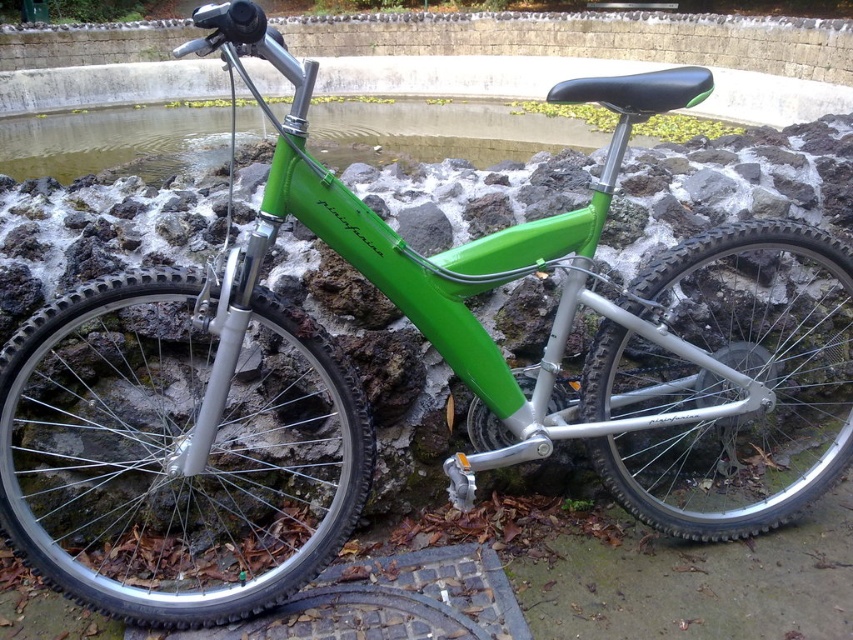
Can you confirm if green rubber tire at lower left is wider than green rubber tire at center?

No, green rubber tire at lower left is not wider than green rubber tire at center.

Looking at this image, can you confirm if green rubber tire at lower left is shorter than green rubber tire at center?

Yes, green rubber tire at lower left is shorter than green rubber tire at center.

What are the coordinates of `green rubber tire at lower left` in the screenshot? It's located at click(x=173, y=452).

Is point (689, 337) positioned after point (364, 124)?

No.

Who is taller, green rubber tire at center or green matte water at upper center?

With more height is green matte water at upper center.

Between point (663, 307) and point (502, 152), which one is positioned in front?

Point (663, 307) is in front.

Locate an element on the screen. green rubber tire at center is located at coordinates (727, 381).

I want to click on green rubber tire at lower left, so click(173, 452).

Is point (277, 496) positioned after point (4, 124)?

No, it is not.

Between point (223, 556) and point (35, 166), which one is positioned behind?

The point (35, 166) is more distant.

At what (x,y) coordinates should I click in order to perform the action: click on green rubber tire at lower left. Please return your answer as a coordinate pair (x, y). Looking at the image, I should click on click(173, 452).